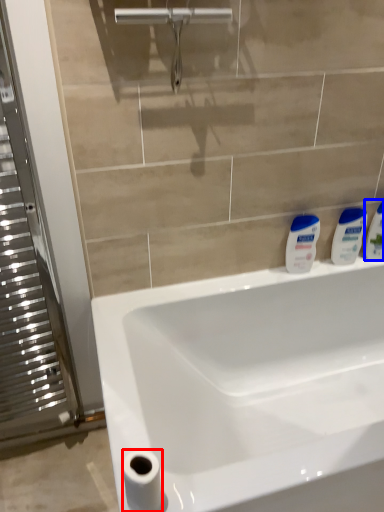
Question: Which object is closer to the camera taking this photo, toilet paper (highlighted by a red box) or toiletry (highlighted by a blue box)?

Choices:
 (A) toilet paper
 (B) toiletry

Answer: (A)